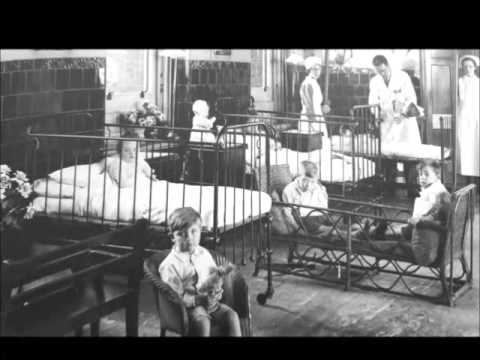
At what (x,y) coordinates should I click in order to perform the action: click on chair. Please return your answer as a coordinate pair (x, y). The height and width of the screenshot is (360, 480). Looking at the image, I should click on (174, 308).